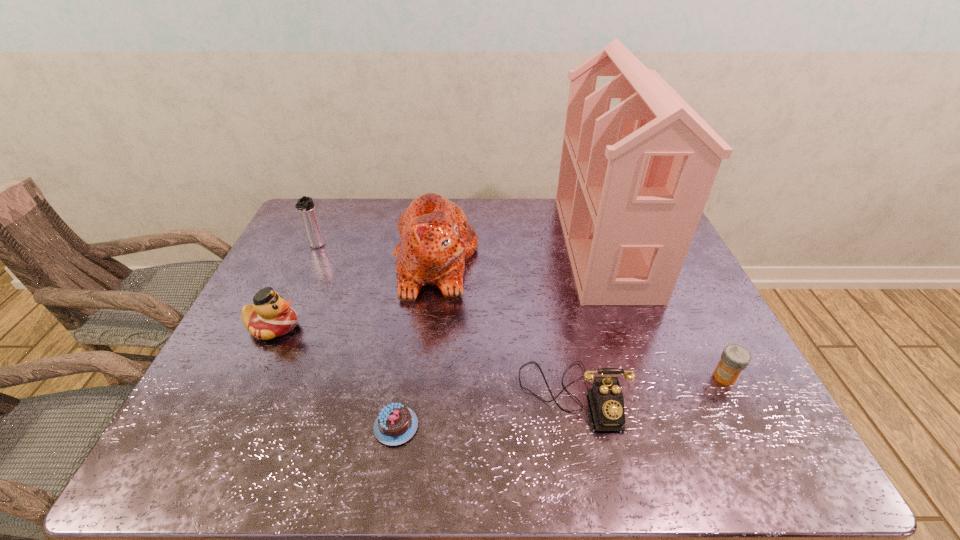
At what (x,y) coordinates should I click in order to perform the action: click on cat that is positioned at the far edge. Please return your answer as a coordinate pair (x, y). The image size is (960, 540). Looking at the image, I should click on coord(436,239).

Where is `telephone that is positioned at the near edge`? This screenshot has width=960, height=540. telephone that is positioned at the near edge is located at coordinates (606, 398).

You are a GUI agent. You are given a task and a screenshot of the screen. Output one action in this format:
    pyautogui.click(x=<x>, y=<y>)
    Task: Click on the chocolate cake that is at the near edge
    The height and width of the screenshot is (540, 960).
    Given the screenshot: What is the action you would take?
    pyautogui.click(x=396, y=424)

Where is `thermos bottle positioned at the left edge`? The width and height of the screenshot is (960, 540). thermos bottle positioned at the left edge is located at coordinates (305, 205).

This screenshot has height=540, width=960. In order to click on duck positioned at the left edge in this screenshot , I will do `click(270, 316)`.

Identify the location of dollhouse that is at the right edge. (633, 182).

Locate an element on the screen. The image size is (960, 540). medicine that is at the right edge is located at coordinates (734, 359).

Image resolution: width=960 pixels, height=540 pixels. Find the location of `object that is at the far right corner`. object that is at the far right corner is located at coordinates (633, 182).

Image resolution: width=960 pixels, height=540 pixels. I want to click on vacant area at the far edge of the desktop, so click(x=361, y=219).

The image size is (960, 540). Find the location of `vacant position at the near edge of the desktop`. vacant position at the near edge of the desktop is located at coordinates (481, 432).